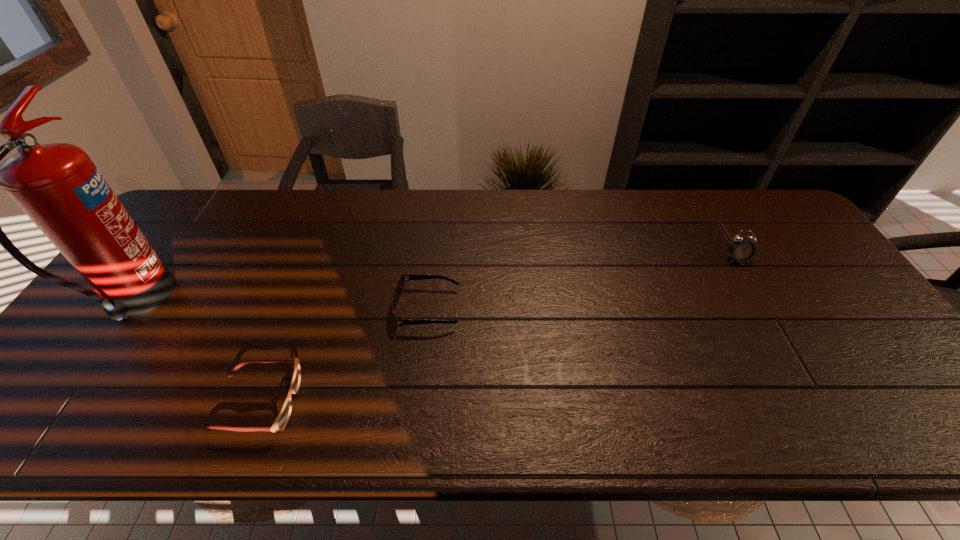
You are a GUI agent. You are given a task and a screenshot of the screen. Output one action in this format:
    pyautogui.click(x=<x>, y=<y>)
    Task: Click on the tallest object
    This screenshot has height=540, width=960.
    Given the screenshot: What is the action you would take?
    click(58, 186)

The image size is (960, 540). In order to click on fire extinguisher in this screenshot , I will do `click(58, 186)`.

The image size is (960, 540). What are the coordinates of `the farthest object` in the screenshot? It's located at (741, 249).

Image resolution: width=960 pixels, height=540 pixels. Identify the location of the third shortest object. (741, 249).

Image resolution: width=960 pixels, height=540 pixels. I want to click on the second object from right to left, so click(398, 289).

Where is `the nearest object`? This screenshot has height=540, width=960. the nearest object is located at coordinates (281, 421).

What are the coordinates of `the second object from left to right` in the screenshot? It's located at (281, 421).

Where is `blank space located on the surface of the fire extinguisher`? The width and height of the screenshot is (960, 540). blank space located on the surface of the fire extinguisher is located at coordinates (238, 304).

Locate an element on the screen. This screenshot has height=540, width=960. free spot located 0.360m on the face of the farthest object is located at coordinates coord(804,375).

The height and width of the screenshot is (540, 960). What are the coordinates of `free space located 0.250m on the front-facing side of the sunglasses` in the screenshot? It's located at (554, 309).